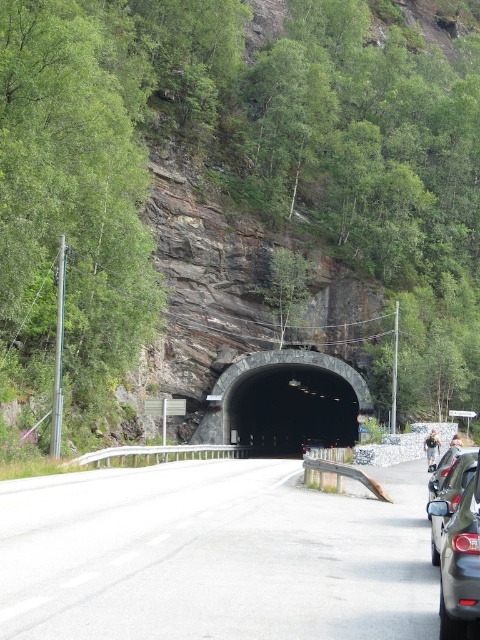
Question: Based on their relative distances, which object is farther from the gray asphalt road at center?

Choices:
 (A) dark gray concrete tunnel at center
 (B) metallic silver car at right
 (C) matte black car at right

Answer: (A)

Question: Which of the following is the farthest from the observer?

Choices:
 (A) (454, 484)
 (B) (452, 628)
 (C) (99, 588)

Answer: (A)

Question: Considering the real-world distances, which object is farthest from the metallic silver car at right?

Choices:
 (A) matte black car at right
 (B) dark gray concrete tunnel at center
 (C) gray asphalt road at center

Answer: (B)

Question: Is matte black car at right closer to camera compared to metallic silver car at right?

Choices:
 (A) no
 (B) yes

Answer: (B)

Question: Is gray asphalt road at center positioned at the back of metallic silver car at right?

Choices:
 (A) no
 (B) yes

Answer: (A)

Question: Does dark gray concrete tunnel at center appear under matte black car at right?

Choices:
 (A) no
 (B) yes

Answer: (B)